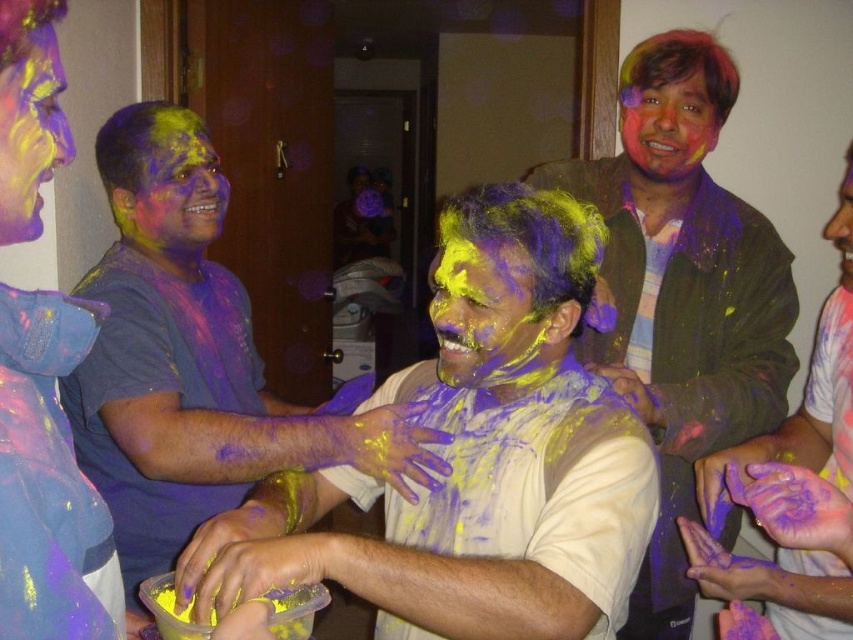
Question: Which of these objects is positioned closest to the matte yellow paint at center?

Choices:
 (A) matte purple shirt at left
 (B) multicolored face paint at upper right

Answer: (B)

Question: Is matte purple face at center bigger than multicolored paint at upper right?

Choices:
 (A) no
 (B) yes

Answer: (B)

Question: Can you confirm if matte purple shirt at center is positioned to the left of multicolored face paint at upper right?

Choices:
 (A) yes
 (B) no

Answer: (A)

Question: Which point is farther from the camera taking this photo?

Choices:
 (A) pyautogui.click(x=0, y=637)
 (B) pyautogui.click(x=183, y=182)
 (C) pyautogui.click(x=770, y=476)
 (D) pyautogui.click(x=663, y=88)

Answer: (B)

Question: Which is farther from the multicolored face paint at upper right?

Choices:
 (A) matte purple face at center
 (B) multicolored paint at upper right
 (C) matte yellow paint at center

Answer: (A)

Question: Can you confirm if multicolored paint at upper right is positioned to the left of smooth skin face at upper right?

Choices:
 (A) yes
 (B) no

Answer: (A)